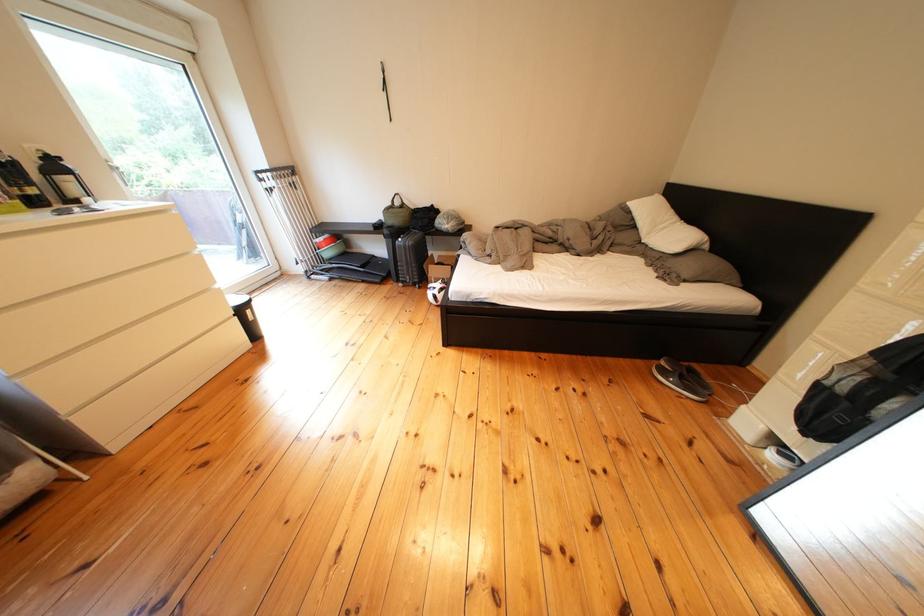
Find the location of a particular element. glass door handle is located at coordinates (114, 169).